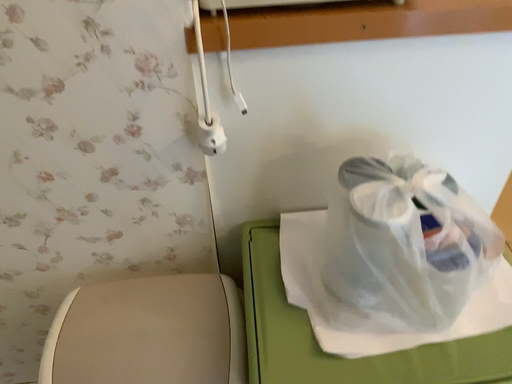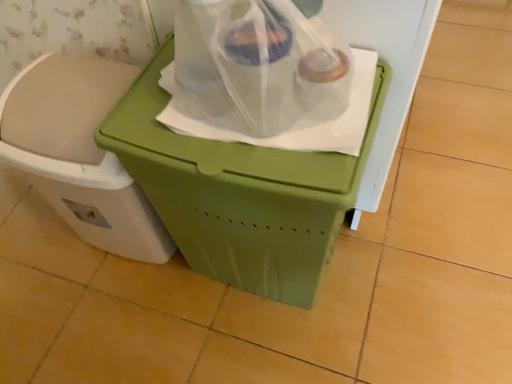
Question: Which way did the camera rotate in the video?

Choices:
 (A) rotated right
 (B) rotated left

Answer: (B)